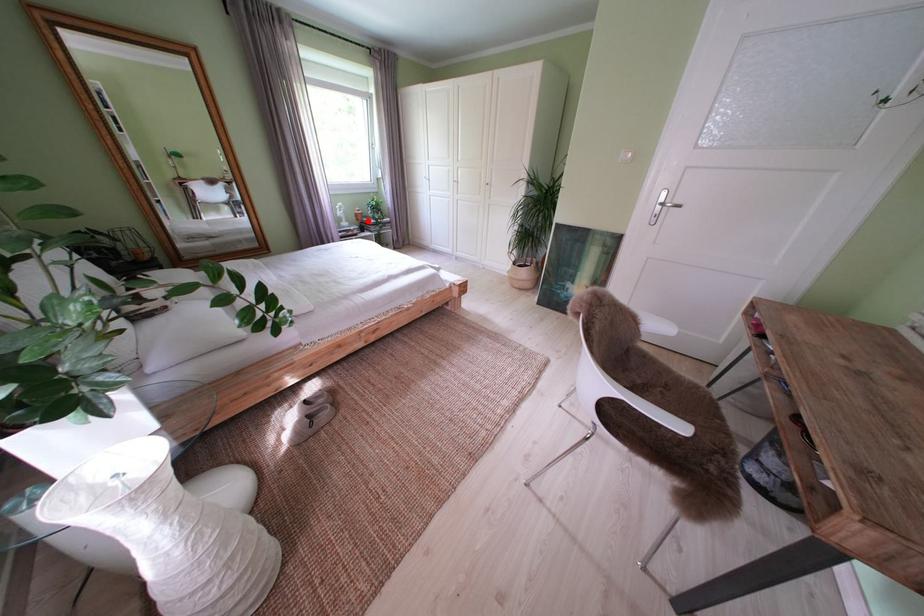
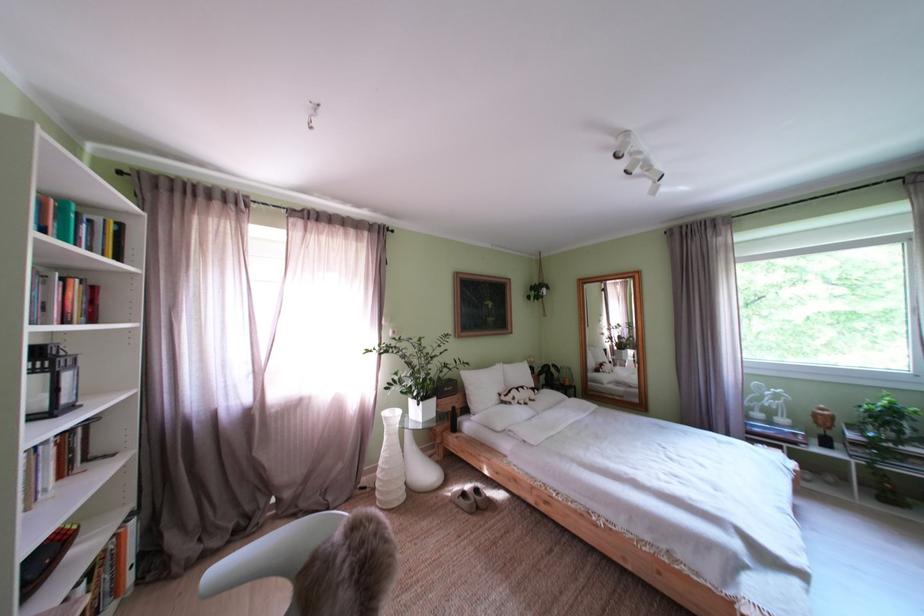
Locate, in the second image, the point that corresponds to the highlighted location in the first image.

(825, 419)